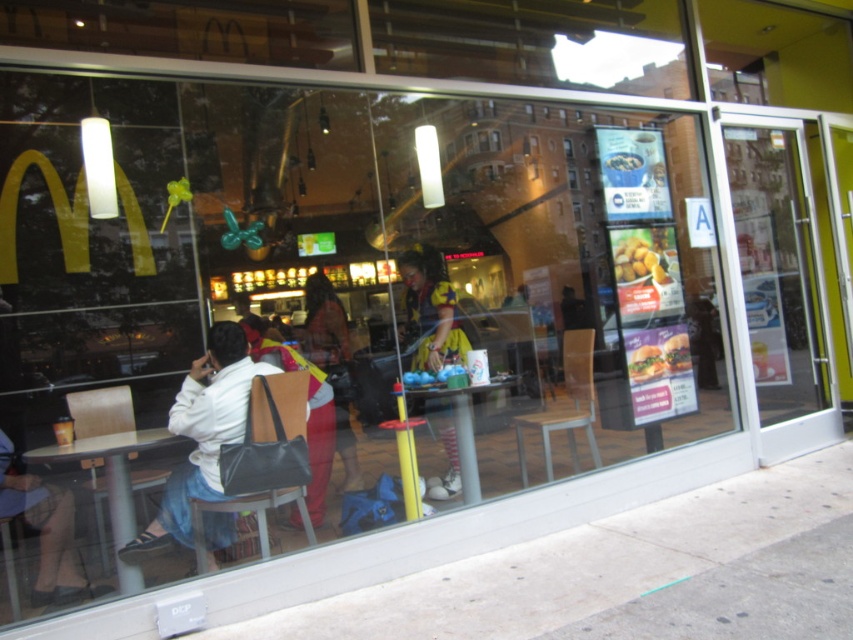
Question: Is the position of white matte jacket at left less distant than that of yellow polka dot dress at center?

Choices:
 (A) no
 (B) yes

Answer: (B)

Question: Which of the following is the farthest from the observer?

Choices:
 (A) (305, 636)
 (B) (354, 470)
 (C) (430, 276)
 (D) (215, 426)

Answer: (C)

Question: Based on their relative distances, which object is farther from the white matte jacket at left?

Choices:
 (A) yellow polka dot dress at center
 (B) matte yellow dress at center
 (C) gray concrete pavement at lower left

Answer: (A)

Question: Which object is positioned closest to the gray concrete pavement at lower left?

Choices:
 (A) yellow polka dot dress at center
 (B) matte yellow dress at center

Answer: (A)

Question: Does white matte jacket at left have a greater width compared to matte yellow dress at center?

Choices:
 (A) yes
 (B) no

Answer: (A)

Question: From the image, what is the correct spatial relationship of white matte jacket at left in relation to yellow polka dot dress at center?

Choices:
 (A) left
 (B) right

Answer: (A)